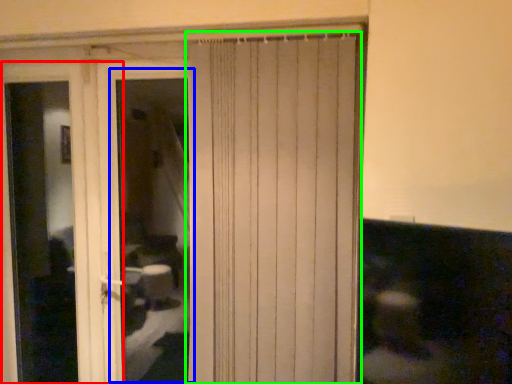
Question: Estimate the real-world distances between objects in this image. Which object is farther from screen door (highlighted by a red box), window (highlighted by a blue box) or curtain (highlighted by a green box)?

Choices:
 (A) window
 (B) curtain

Answer: (A)